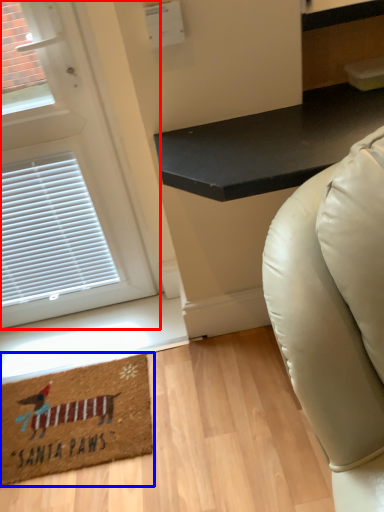
Question: Which of the following is the farthest to the observer, door (highlighted by a red box) or mat (highlighted by a blue box)?

Choices:
 (A) door
 (B) mat

Answer: (B)